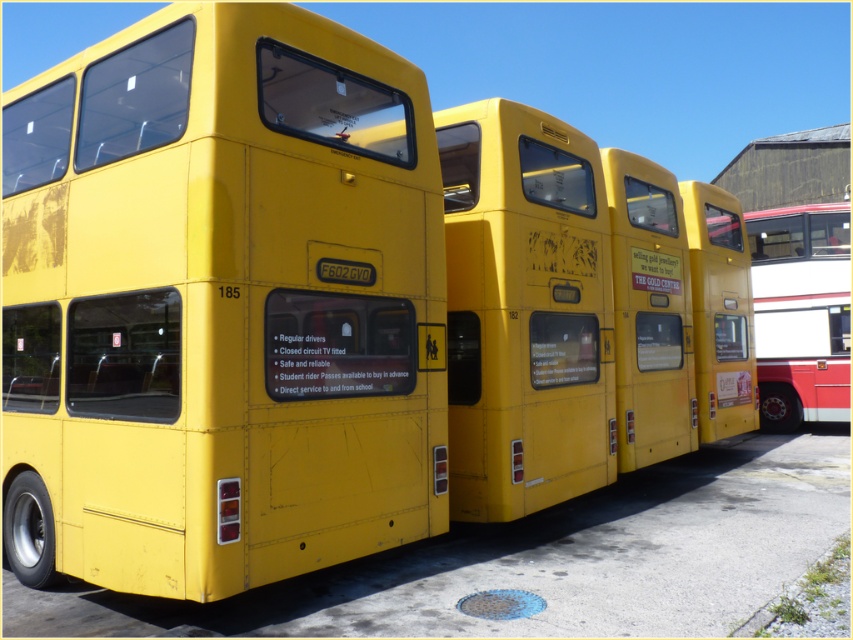
Is yellow matte bus at center thinner than yellow matte bus at right?

Indeed, yellow matte bus at center has a lesser width compared to yellow matte bus at right.

Is yellow matte bus at center to the right of yellow matte bus at right from the viewer's perspective?

In fact, yellow matte bus at center is to the left of yellow matte bus at right.

At what (x,y) coordinates should I click in order to perform the action: click on yellow matte bus at center. Please return your answer as a coordinate pair (x, y). Image resolution: width=853 pixels, height=640 pixels. Looking at the image, I should click on (556, 310).

Find the location of a particular element. The image size is (853, 640). yellow matte bus at center is located at coordinates (556, 310).

Can you confirm if matte yellow bus at left is shorter than yellow matte bus at center?

No.

Is matte yellow bus at left positioned in front of yellow matte bus at center?

Yes, it is.

Identify the location of matte yellow bus at left. (219, 305).

Looking at this image, is matte yellow bus at left to the right of yellow matte bus at right from the viewer's perspective?

Incorrect, matte yellow bus at left is not on the right side of yellow matte bus at right.

Which is behind, point (422, 124) or point (759, 248)?

Positioned behind is point (759, 248).

The width and height of the screenshot is (853, 640). What do you see at coordinates (219, 305) in the screenshot? I see `matte yellow bus at left` at bounding box center [219, 305].

Where is `matte yellow bus at left`? matte yellow bus at left is located at coordinates (219, 305).